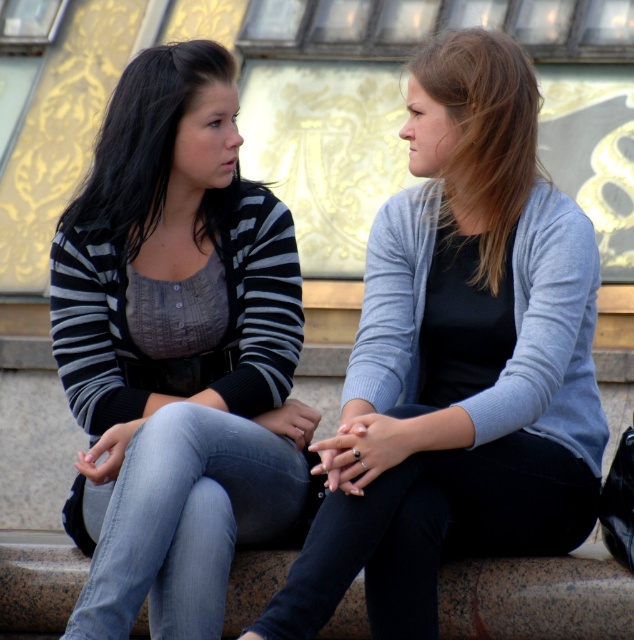
In the scene shown: You are standing in front of the scene and want to touch the light blue sweater at center and the striped knit sweater at left. Which one can you reach without moving your position?

The light blue sweater at center is closer to the viewer than the striped knit sweater at left, so you can reach the light blue sweater at center without moving your position.

You are standing in front of the decorative wall with intricate golden patterns. You see a point at coordinates (x=176, y=352). Based on the scene, can you tell me what object this point is located on?

The point at coordinates (x=176, y=352) is located on the matte black sweater at left.